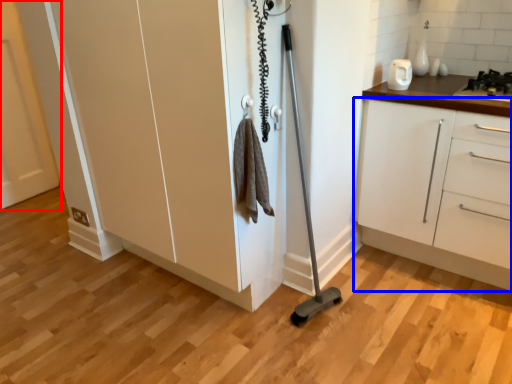
Question: Which point is closer to the camera, door (highlighted by a red box) or cabinetry (highlighted by a blue box)?

Choices:
 (A) door
 (B) cabinetry

Answer: (B)